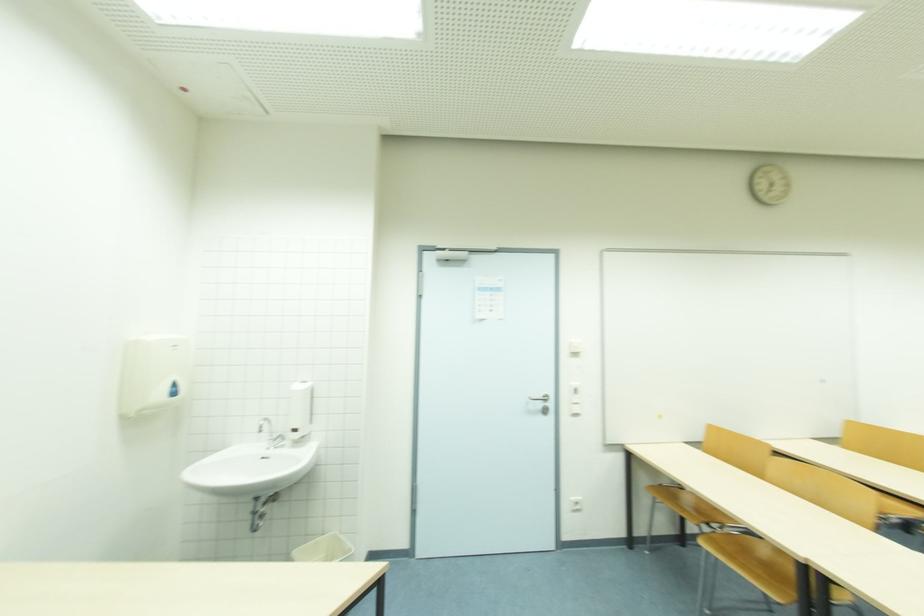
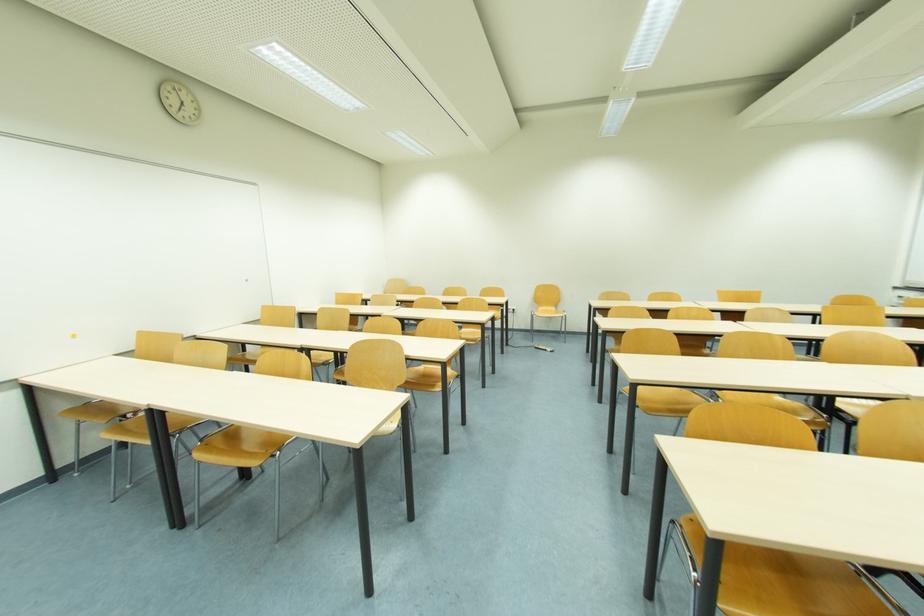
Question: How did the camera likely rotate?

Choices:
 (A) Left
 (B) Right
 (C) Up
 (D) Down

Answer: (B)